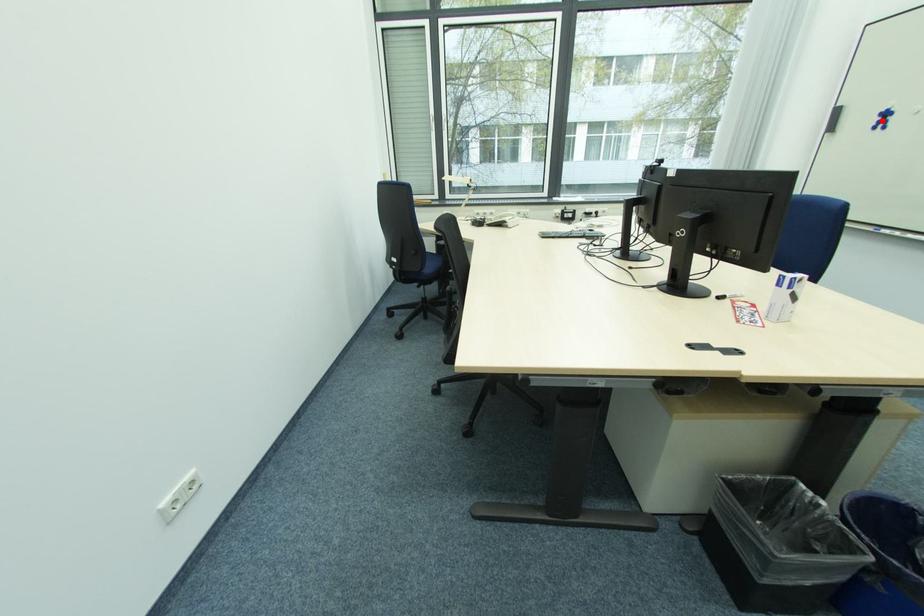
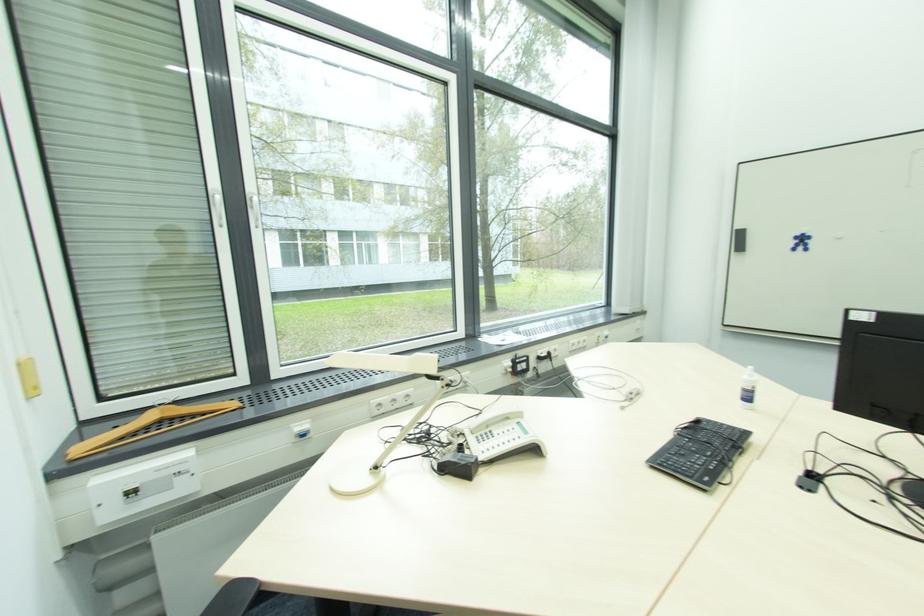
Question: I am providing you with two images of the same scene from different viewpoints. A red point is shown in image1. For the corresponding object point in image2, is it positioned nearer or farther from the camera?

Choices:
 (A) Nearer
 (B) Farther

Answer: (A)